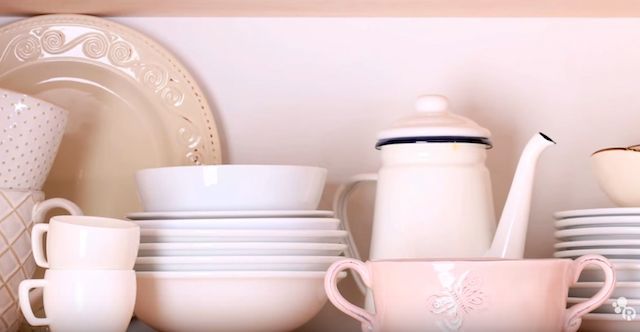
Locate an element on the screen. cups is located at coordinates pyautogui.click(x=18, y=141), pyautogui.click(x=13, y=229), pyautogui.click(x=93, y=291), pyautogui.click(x=493, y=309), pyautogui.click(x=612, y=191).